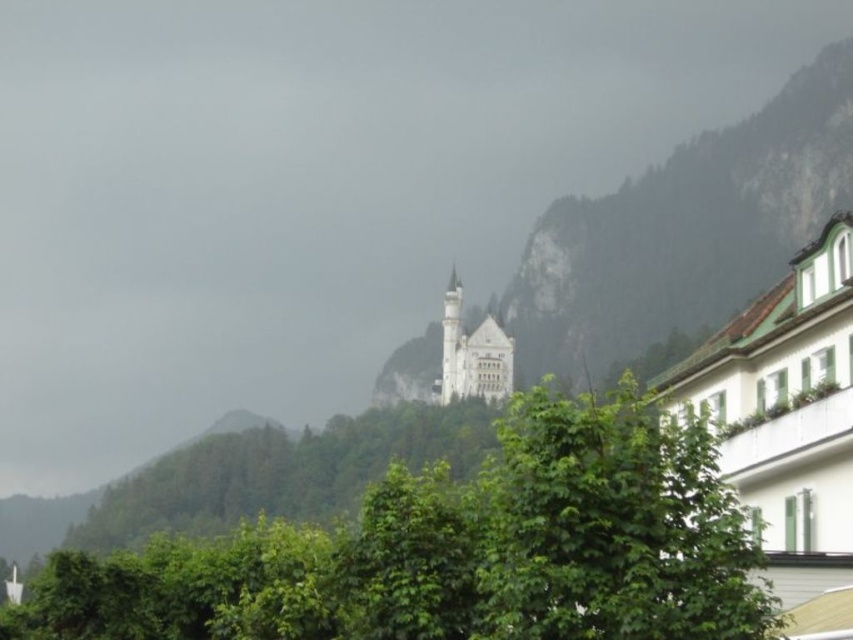
You are standing at the base of the hill where the castle is located. You see a point marked at coordinates (457, 550). What object does this point correspond to in the scene?

The point at coordinates (457, 550) corresponds to the green leafy tree at center.

You are an architect designing a new garden layout. You want to place a statue between the green leafy tree at center and the white stone castle at center. Which object should the statue be closer to if it needs to be closer to the smaller one?

The statue should be closer to the green leafy tree at center because it is smaller than the white stone castle at center.

You are a tourist standing in front of the white stone castle at center and want to take a photo of it. However, there is a green leafy tree at center blocking your view. Can you move to the right to get a clear shot without the tree in the way?

The green leafy tree at center is positioned under the white stone castle at center, so moving to the right might not remove the tree from the frame. The tree is directly beneath the castle, so shifting your position sideways may still leave the tree obstructing the view.